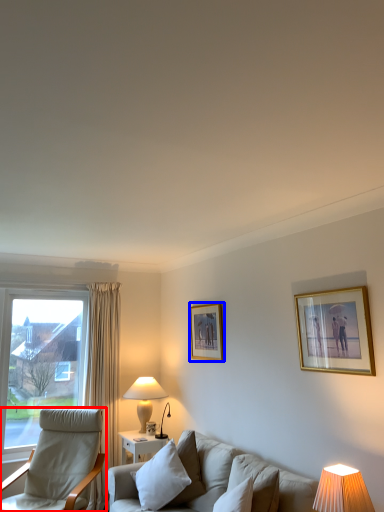
Question: Which of the following is the closest to the observer, chair (highlighted by a red box) or picture frame (highlighted by a blue box)?

Choices:
 (A) chair
 (B) picture frame

Answer: (A)